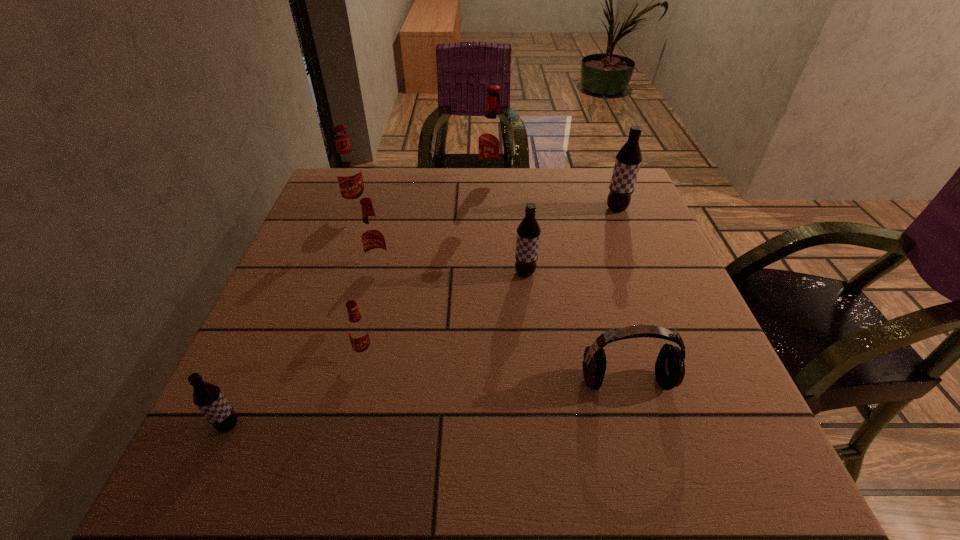
Identify the location of the second nearest root beer. The width and height of the screenshot is (960, 540). (359, 334).

Where is `the nearest red root beer`? the nearest red root beer is located at coordinates (359, 334).

This screenshot has width=960, height=540. In order to click on the leftmost object in this screenshot , I will do (x=208, y=397).

Identify the location of the leftmost brown root beer. The height and width of the screenshot is (540, 960). (208, 397).

Identify the location of free space located on the left of the rightmost red root beer. (461, 181).

Find the location of `free spot located on the back of the second farthest red root beer`. free spot located on the back of the second farthest red root beer is located at coordinates (365, 185).

Where is `vacant space located on the front of the biggest brown root beer`? Image resolution: width=960 pixels, height=540 pixels. vacant space located on the front of the biggest brown root beer is located at coordinates (657, 308).

The height and width of the screenshot is (540, 960). I want to click on vacant space located on the back of the second nearest red root beer, so click(389, 229).

Locate an element on the screen. The width and height of the screenshot is (960, 540). vacant space located on the right of the second brown root beer from right to left is located at coordinates (603, 273).

At what (x,y) coordinates should I click in order to perform the action: click on vacant space located on the ear cups of the seventh farthest object. Please return your answer as a coordinate pair (x, y). The image size is (960, 540). Looking at the image, I should click on (642, 436).